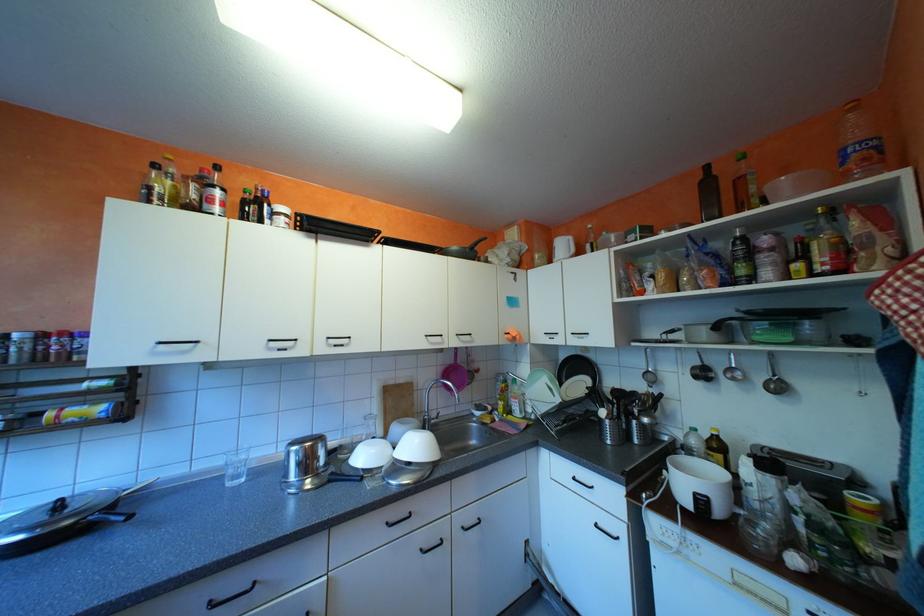
Where would you push the toaster lever? Please return your answer as a coordinate pair (x, y).

(810, 469)